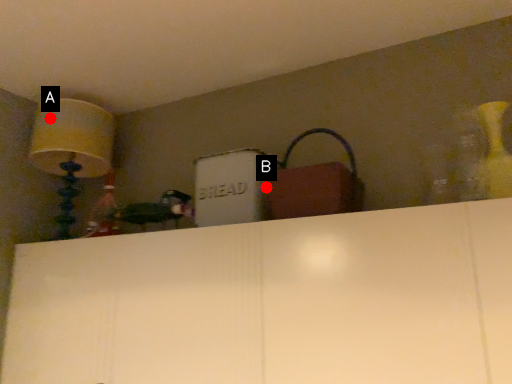
Question: Two points are circled on the image, labeled by A and B beside each circle. Among these points, which one is nearest to the camera?

Choices:
 (A) A is closer
 (B) B is closer

Answer: (B)